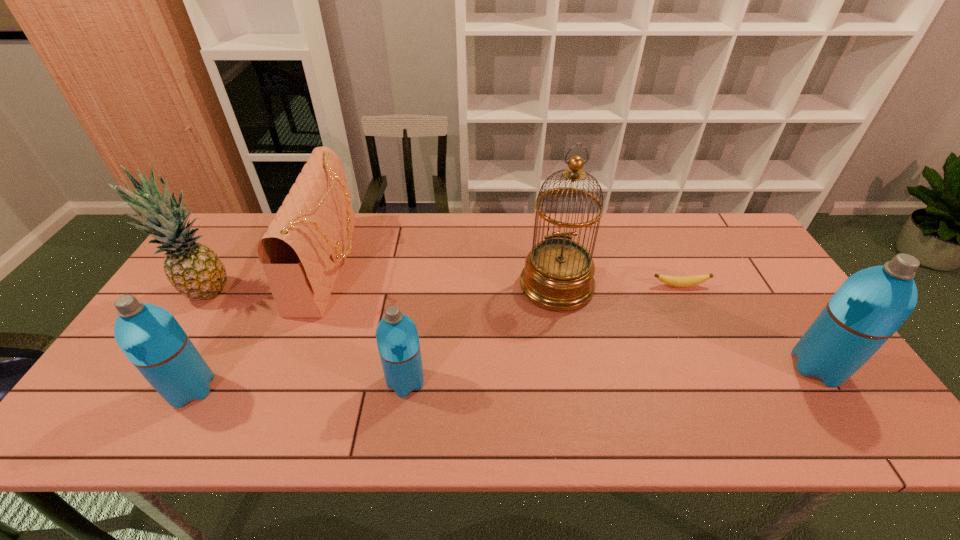
To ensure equal spacing by inserting another thermos_bottle among them, please point out a vacant spot for this new thermos_bottle. Please provide its 2D coordinates. Your answer should be formatted as a tuple, i.e. [(x, y)], where the tuple contains the x and y coordinates of a point satisfying the conditions above.

[(614, 374)]